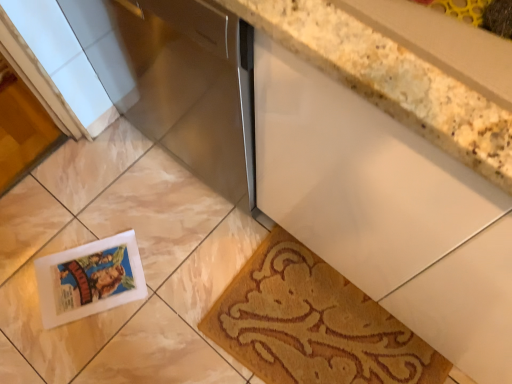
Identify the location of free space above white glossy postcard at lower left (from a real-world perspective). The height and width of the screenshot is (384, 512). (87, 271).